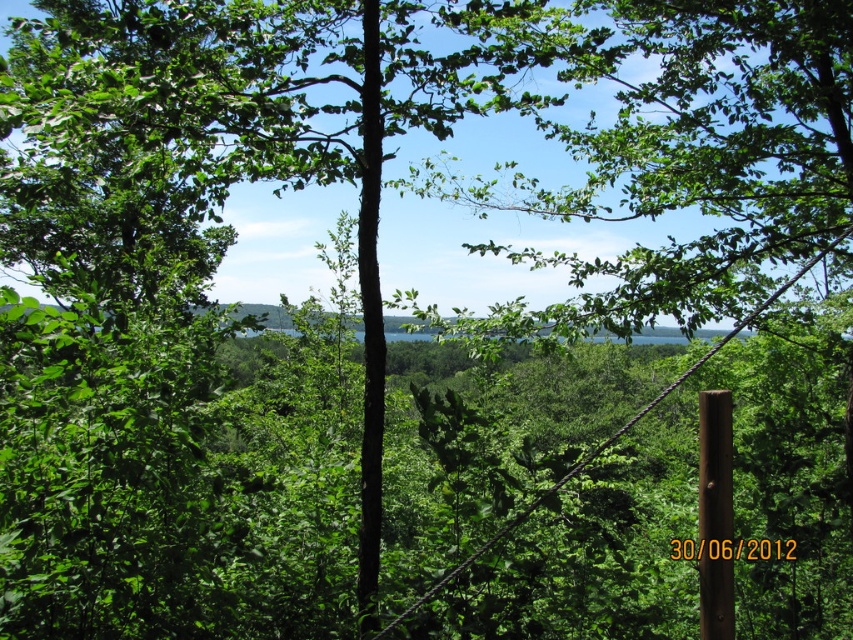
Does black wood pole at center have a lesser height compared to brown wooden pole at right?

No, black wood pole at center is not shorter than brown wooden pole at right.

Between point (373, 548) and point (712, 538), which one is positioned behind?

The point (373, 548) is more distant.

Locate an element on the screen. Image resolution: width=853 pixels, height=640 pixels. black wood pole at center is located at coordinates (370, 321).

Image resolution: width=853 pixels, height=640 pixels. In order to click on black wood pole at center in this screenshot , I will do `click(370, 321)`.